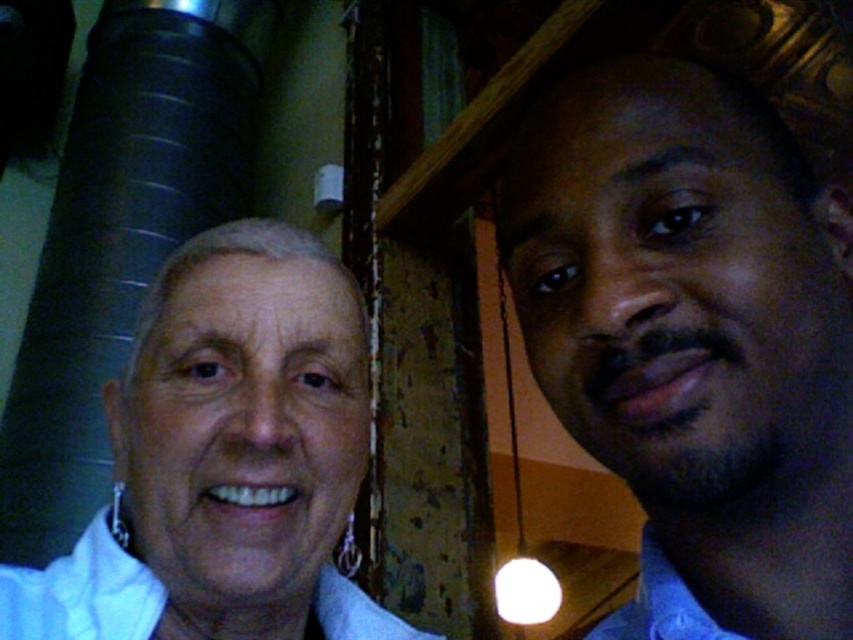
You are a photographer trying to capture a closeup of the smooth skin face at right in the image. The camera you are using has a focus point at the center. Since the focus point is at the center of the viewfinder, which is at coordinate point (x=693, y=339), will the smooth skin face at right be in focus?

The smooth skin face at right is located at point (x=693, y=339), so yes, the camera focus point at that coordinate will capture the smooth skin face at right in focus.

You are a photographer setting up a photo shoot. You need to position a spotlight so that it illuminates the smooth skin face at right without affecting the white cotton dress shirt at lower left. Is this possible given their current positions?

Yes, the smooth skin face at right is in front of the white cotton dress shirt at lower left, so you can position the spotlight to shine on the face while keeping the shirt in shadow by angling the light appropriately.

You are a photographer trying to focus on the white matte soft skin at center represented by point [225,458]. Can you confirm if the point is located on the older woman or the younger man?

The white matte soft skin at center represented by point [225,458] is located on the older woman since she is described as having white matte skin and the man has darker skin.